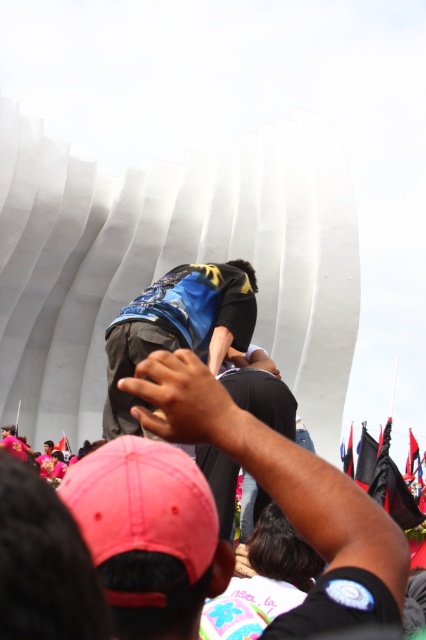
Find the location of a particular element. The height and width of the screenshot is (640, 426). blue fabric shirt at center is located at coordinates (175, 324).

Does point (141, 292) come farther from viewer compared to point (344, 464)?

No, (141, 292) is in front of (344, 464).

This screenshot has width=426, height=640. Describe the element at coordinates (175, 324) in the screenshot. I see `blue fabric shirt at center` at that location.

Find the location of `blue fabric shirt at center`. blue fabric shirt at center is located at coordinates (175, 324).

Which is more to the right, black matte shirt at center or blue fabric shirt at center?

black matte shirt at center

Can you confirm if black matte shirt at center is smaller than blue fabric shirt at center?

No.

Identify the location of black matte shirt at center. This screenshot has width=426, height=640. (287, 497).

Who is more distant from viewer, (x=331, y=618) or (x=350, y=467)?

The point (x=350, y=467) is more distant.

Between black matte shirt at center and black fabric flag at center, which one is positioned higher?

black matte shirt at center is higher up.

What do you see at coordinates (287, 497) in the screenshot?
I see `black matte shirt at center` at bounding box center [287, 497].

Find the location of a particular element. black matte shirt at center is located at coordinates pos(287,497).